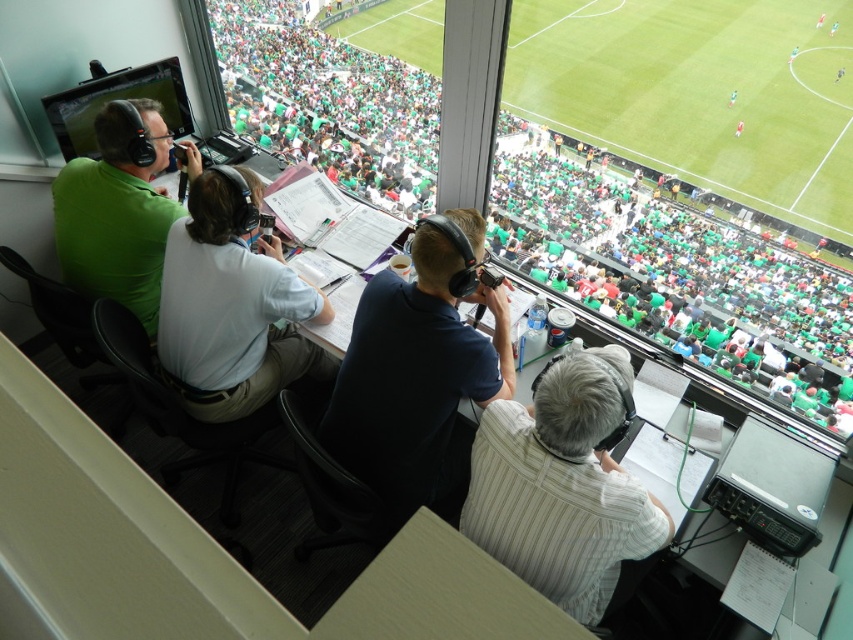
Question: Which point appears closest to the camera in this image?

Choices:
 (A) (476, 500)
 (B) (137, 253)

Answer: (A)

Question: Is white striped shirt at center above white cotton shirt at center?

Choices:
 (A) yes
 (B) no

Answer: (B)

Question: Where is white striped shirt at center located in relation to dark blue shirt at center in the image?

Choices:
 (A) above
 (B) below

Answer: (B)

Question: Which point is closer to the camera?

Choices:
 (A) (202, 378)
 (B) (137, 314)

Answer: (A)

Question: Does white cotton shirt at center have a smaller size compared to green matte shirt at upper left?

Choices:
 (A) no
 (B) yes

Answer: (A)

Question: Which of these objects is positioned farthest from the green matte shirt at upper left?

Choices:
 (A) white striped shirt at center
 (B) dark blue shirt at center
 (C) white cotton shirt at center

Answer: (A)